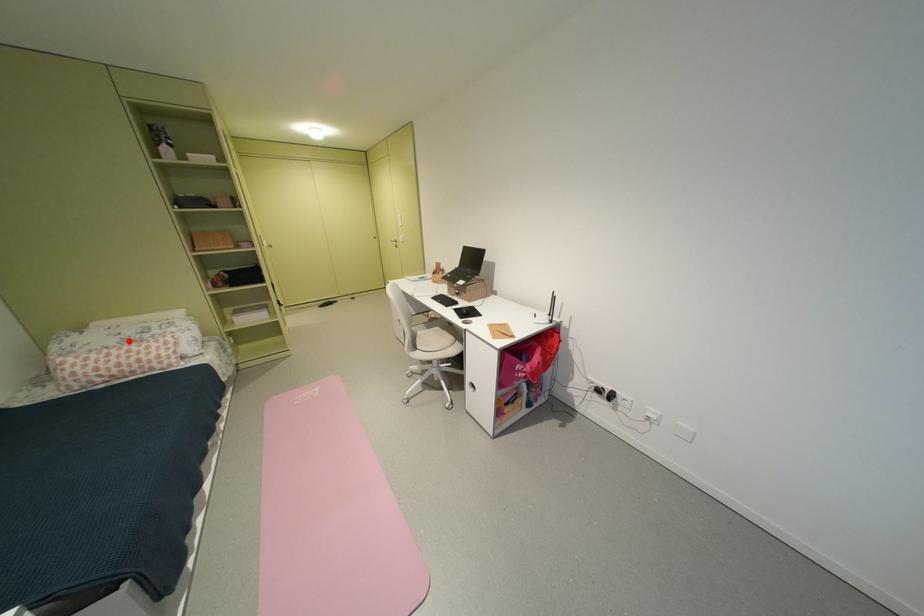
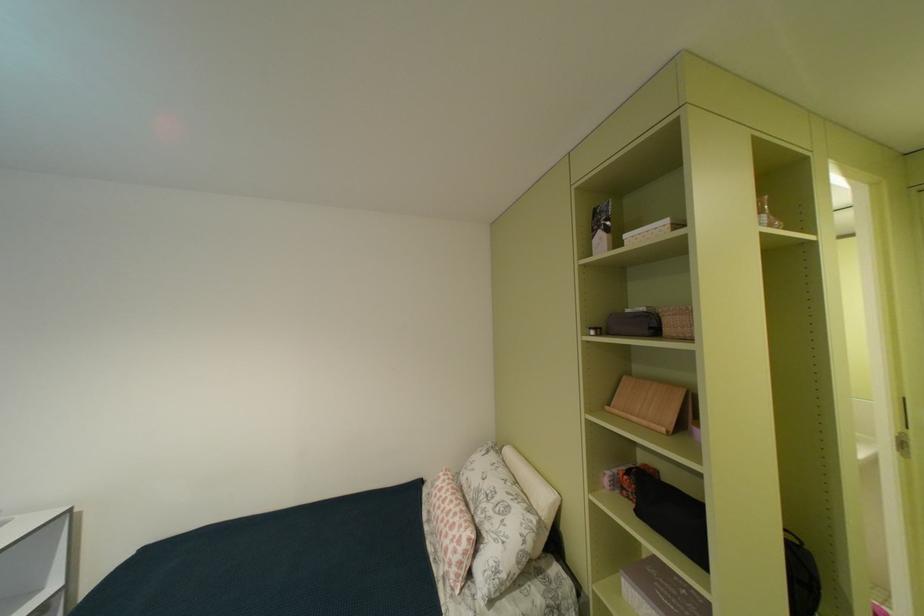
Question: I am providing you with two images of the same scene from different viewpoints. Image1 has a red point marked. In image2, the corresponding 3D location appears at what relative position? Reply with the corresponding letter.

Choices:
 (A) Closer
 (B) Farther

Answer: (B)